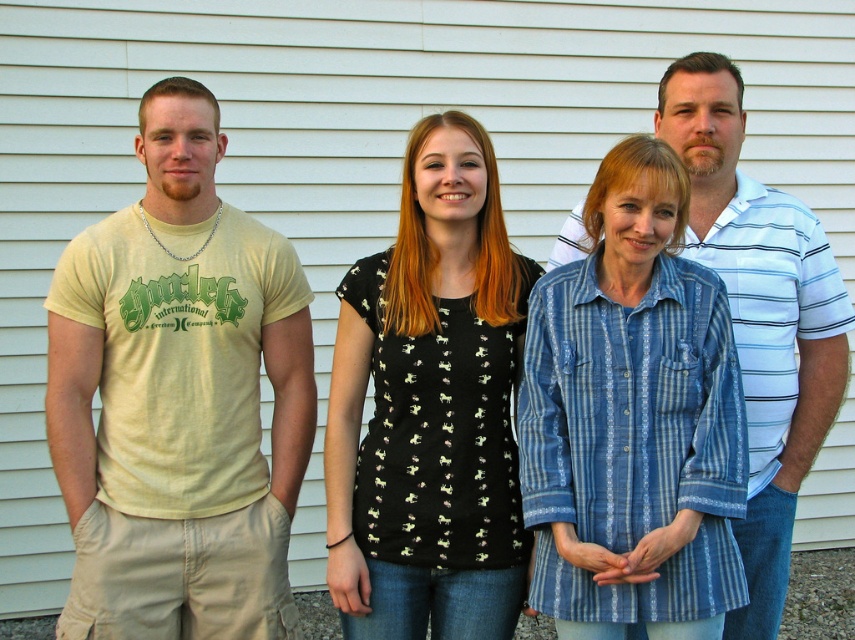
You are taking a photo of two points in the scene. The first point is at position point [151,353] and the second point is at point [762,534]. Which point is closer to the camera?

Point [151,353] is closer to the camera than point [762,534].